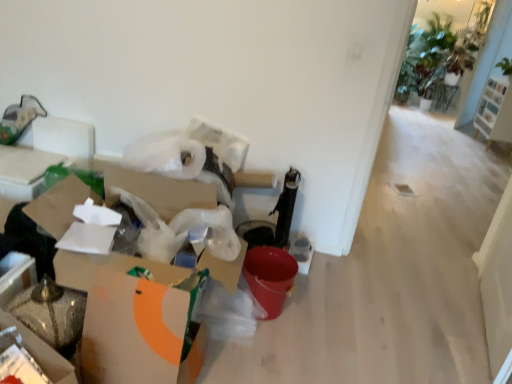
Question: Is white cardboard box at lower left, positioned as the first cardboard box in front-to-back order, situated inside white wood shoe rack at upper right or outside?

Choices:
 (A) inside
 (B) outside

Answer: (B)

Question: Considering their positions, is white cardboard box at lower left, the 2th cardboard box positioned from the back, located in front of or behind white wood shoe rack at upper right?

Choices:
 (A) front
 (B) behind

Answer: (A)

Question: Considering the real-world distances, which object is farthest from the white cardboard box at left, which ranks as the second cardboard box in front-to-back order?

Choices:
 (A) white cardboard box at lower left, positioned as the first cardboard box in front-to-back order
 (B) white wood shoe rack at upper right

Answer: (B)

Question: Estimate the real-world distances between objects in this image. Which object is farther from the white cardboard box at lower left, positioned as the first cardboard box in front-to-back order?

Choices:
 (A) white cardboard box at left, which ranks as the second cardboard box in front-to-back order
 (B) white wood shoe rack at upper right

Answer: (B)